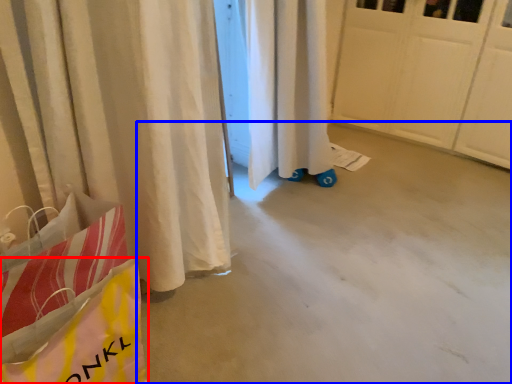
Question: Which object appears farthest to the camera in this image, grocery bag (highlighted by a red box) or concrete (highlighted by a blue box)?

Choices:
 (A) grocery bag
 (B) concrete

Answer: (B)